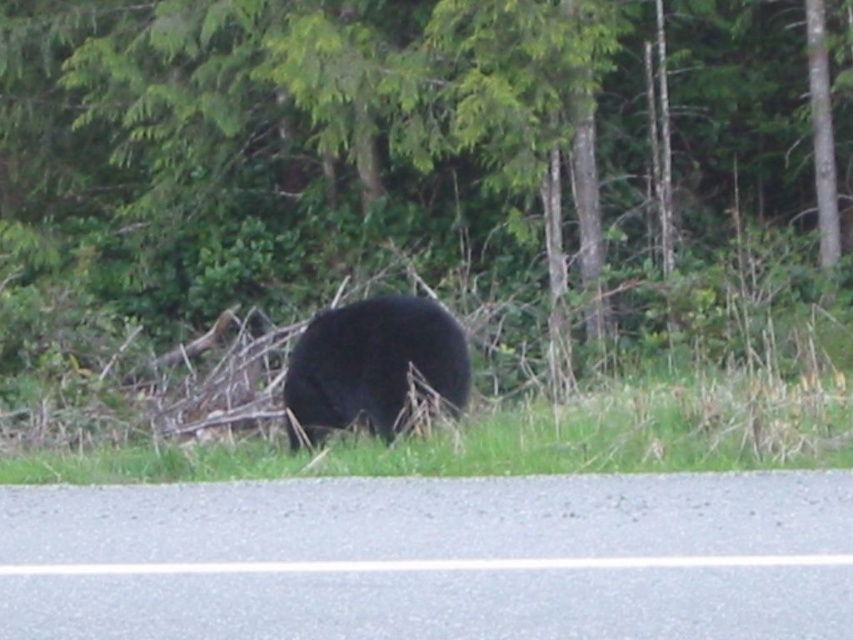
Question: Which point appears farthest from the camera in this image?

Choices:
 (A) [752, 99]
 (B) [344, 323]

Answer: (A)

Question: Is green leafy tree at center closer to camera compared to black furry bear at center?

Choices:
 (A) no
 (B) yes

Answer: (A)

Question: Is the position of green leafy tree at center more distant than that of black furry bear at center?

Choices:
 (A) yes
 (B) no

Answer: (A)

Question: Among these points, which one is nearest to the camera?

Choices:
 (A) (289, 404)
 (B) (125, 1)

Answer: (A)

Question: Can you confirm if green leafy tree at center is positioned to the right of black furry bear at center?

Choices:
 (A) no
 (B) yes

Answer: (B)